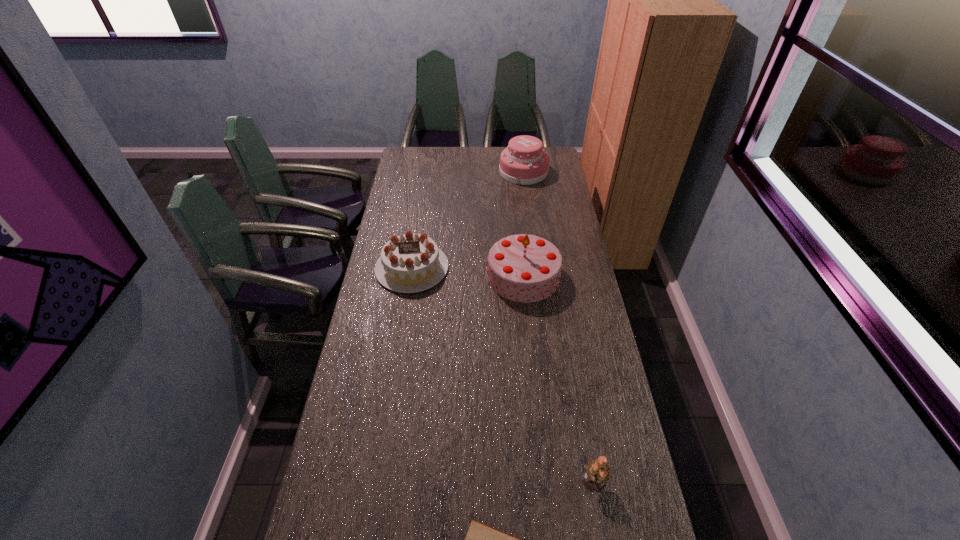
Find the location of a particular element. object that is at the far edge is located at coordinates (524, 162).

You are a GUI agent. You are given a task and a screenshot of the screen. Output one action in this format:
    pyautogui.click(x=<x>, y=<y>)
    Task: Click on the object located at the left edge
    This screenshot has height=540, width=960.
    Given the screenshot: What is the action you would take?
    pyautogui.click(x=409, y=263)

Locate an element on the screen. candle holder located in the right edge section of the desktop is located at coordinates (597, 473).

Identify the location of object at the far right corner. Image resolution: width=960 pixels, height=540 pixels. (524, 162).

Where is `free space at the left edge of the desktop`? free space at the left edge of the desktop is located at coordinates (372, 289).

Identify the location of free location at the right edge. This screenshot has width=960, height=540. (541, 232).

Where is `free location at the far left corner`? free location at the far left corner is located at coordinates (408, 168).

The image size is (960, 540). I want to click on free space between the leftmost birthday cake and the fourth farthest object, so click(503, 374).

The image size is (960, 540). I want to click on empty location between the tallest object and the farthest object, so click(523, 224).

Identify the location of free spot between the fourth farthest object and the tallest birthday cake. The width and height of the screenshot is (960, 540). (559, 378).